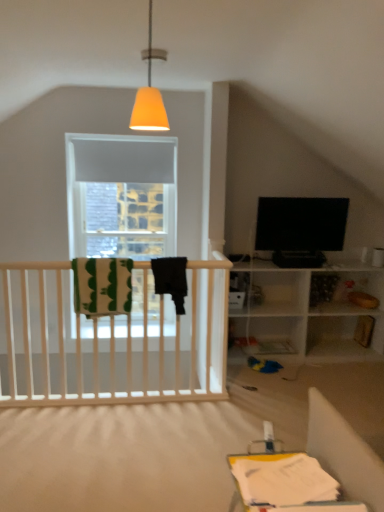
You are a GUI agent. You are given a task and a screenshot of the screen. Output one action in this format:
    pyautogui.click(x=<x>, y=<y>)
    Task: Click on the black glossy tv at upper right
    The image size is (384, 512).
    Given the screenshot: What is the action you would take?
    pyautogui.click(x=300, y=229)

The image size is (384, 512). Describe the element at coordinates (150, 94) in the screenshot. I see `matte orange cone at upper center` at that location.

What do you see at coordinates (102, 286) in the screenshot? I see `green striped blanket at left` at bounding box center [102, 286].

Where is `black glossy tv at upper right`? black glossy tv at upper right is located at coordinates (300, 229).

Is black glossy tv at upper right further to the viewer compared to green striped blanket at left?

Yes, the depth of black glossy tv at upper right is greater than that of green striped blanket at left.

Which of these two, black glossy tv at upper right or green striped blanket at left, is bigger?

black glossy tv at upper right.

Between black glossy tv at upper right and green striped blanket at left, which one has larger width?

green striped blanket at left.

From a real-world perspective, is black glossy tv at upper right physically above matte orange cone at upper center?

No, from a real-world perspective, black glossy tv at upper right is not on top of matte orange cone at upper center.

Are black glossy tv at upper right and matte orange cone at upper center beside each other?

No.

What's the angular difference between black glossy tv at upper right and matte orange cone at upper center's facing directions?

The angle between the facing direction of black glossy tv at upper right and the facing direction of matte orange cone at upper center is 4.61 degrees.

Does black glossy tv at upper right have a smaller size compared to matte orange cone at upper center?

No.

Which object is further away from the camera, matte orange cone at upper center or green striped blanket at left?

green striped blanket at left is behind.

Do you think matte orange cone at upper center is within green striped blanket at left, or outside of it?

matte orange cone at upper center is spatially situated outside green striped blanket at left.

Does point (147, 121) lie behind point (84, 280)?

No, it is in front of (84, 280).

At what (x,y) coordinates should I click in order to perform the action: click on blanket on the left of matte orange cone at upper center. Please return your answer as a coordinate pair (x, y). The image size is (384, 512). Looking at the image, I should click on (102, 286).

Can you tell me how much green striped blanket at left and matte orange cone at upper center differ in facing direction?

The angular difference between green striped blanket at left and matte orange cone at upper center is 1.33 degrees.

Is green striped blanket at left situated inside matte orange cone at upper center or outside?

green striped blanket at left is located beyond the bounds of matte orange cone at upper center.

Does green striped blanket at left turn towards matte orange cone at upper center?

No, green striped blanket at left is not aimed at matte orange cone at upper center.

Would you consider green striped blanket at left to be distant from matte orange cone at upper center?

Yes, green striped blanket at left and matte orange cone at upper center are quite far apart.

Is green striped blanket at left next to black glossy tv at upper right and touching it?

No, green striped blanket at left is not in contact with black glossy tv at upper right.

Is point (128, 280) farther from viewer compared to point (290, 206)?

No, it is not.

From the image's perspective, is green striped blanket at left on top of black glossy tv at upper right?

No, from the image's perspective, green striped blanket at left is not over black glossy tv at upper right.

Which object is positioned more to the right, green striped blanket at left or black glossy tv at upper right?

black glossy tv at upper right.

From the image's perspective, which one is positioned higher, matte orange cone at upper center or black glossy tv at upper right?

matte orange cone at upper center appears higher in the image.

From a real-world perspective, which is physically below, matte orange cone at upper center or black glossy tv at upper right?

black glossy tv at upper right is physically lower.

Is matte orange cone at upper center at the left side of black glossy tv at upper right?

Yes.

Is matte orange cone at upper center positioned in front of black glossy tv at upper right?

Yes, it is in front of black glossy tv at upper right.

The width and height of the screenshot is (384, 512). Identify the location of blanket lying below the black glossy tv at upper right (from the image's perspective). (102, 286).

I want to click on lamp that is above the black glossy tv at upper right (from a real-world perspective), so click(x=150, y=94).

Which object lies further to the anchor point green striped blanket at left, matte orange cone at upper center or black glossy tv at upper right?

The object further to green striped blanket at left is matte orange cone at upper center.

Which object lies nearer to the anchor point black glossy tv at upper right, green striped blanket at left or matte orange cone at upper center?

Among the two, green striped blanket at left is located nearer to black glossy tv at upper right.

Estimate the real-world distances between objects in this image. Which object is closer to matte orange cone at upper center, green striped blanket at left or black glossy tv at upper right?

The object closer to matte orange cone at upper center is green striped blanket at left.

Considering their positions, is black glossy tv at upper right positioned closer to green striped blanket at left than matte orange cone at upper center?

black glossy tv at upper right lies closer to green striped blanket at left than the other object.

Looking at the image, which one is located closer to black glossy tv at upper right, matte orange cone at upper center or green striped blanket at left?

The object closer to black glossy tv at upper right is green striped blanket at left.

From the image, which object appears to be nearer to matte orange cone at upper center, black glossy tv at upper right or green striped blanket at left?

Among the two, green striped blanket at left is located nearer to matte orange cone at upper center.

This screenshot has width=384, height=512. I want to click on blanket positioned between matte orange cone at upper center and black glossy tv at upper right from near to far, so click(102, 286).